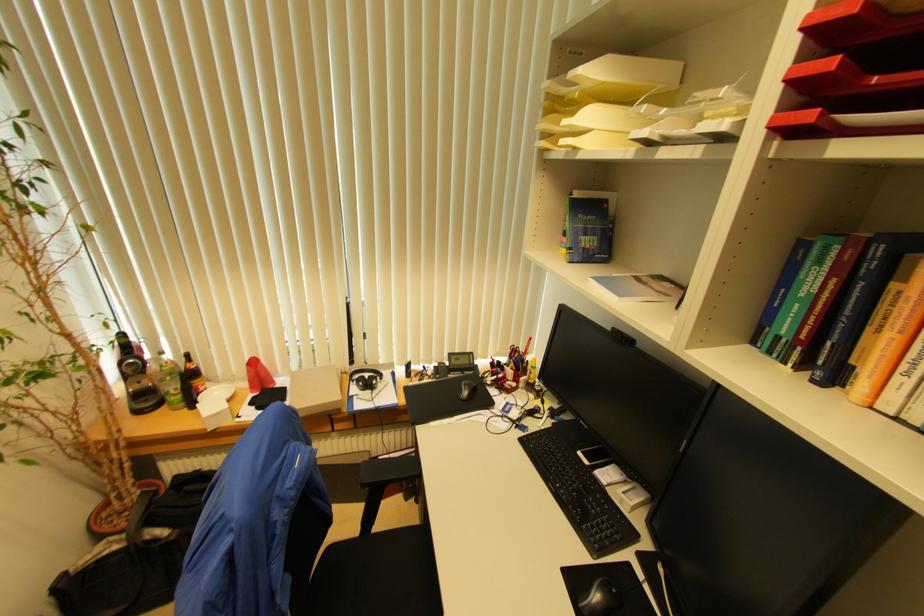
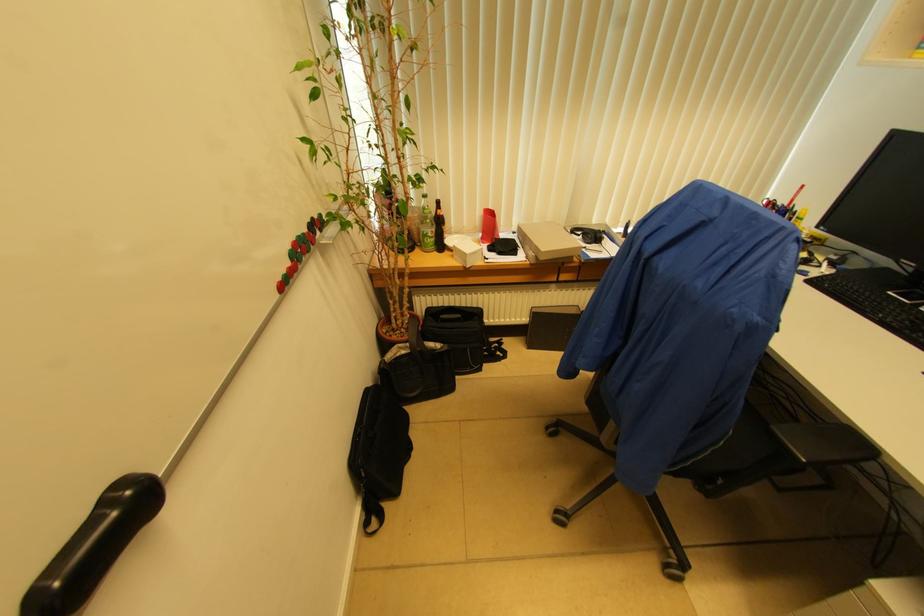
Question: In a continuous first-person perspective shot, in which direction is the camera moving?

Choices:
 (A) Left
 (B) Right
 (C) Forward
 (D) Backward

Answer: (A)